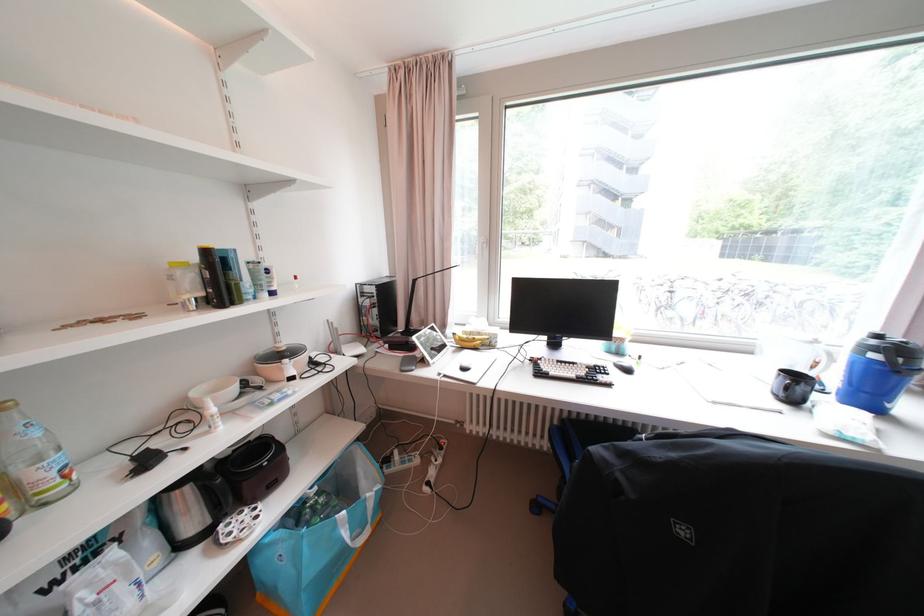
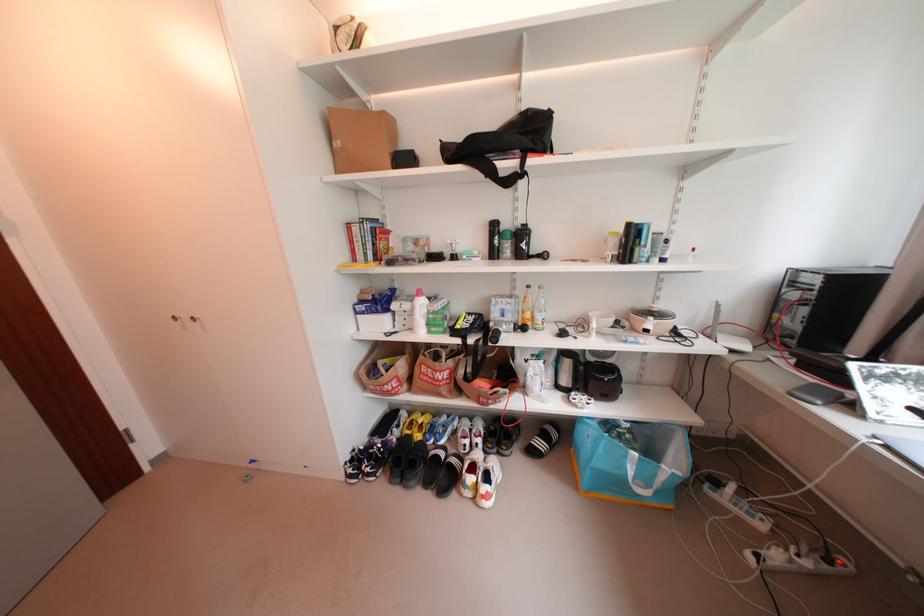
The images are taken continuously from a first-person perspective. In which direction is your viewpoint rotating?

The camera rotated toward left-down.